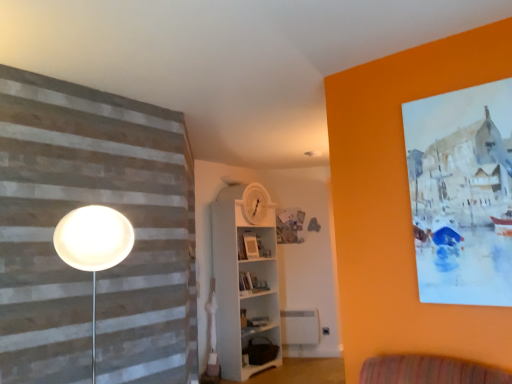
Question: Can you confirm if brown fabric bag at lower center, which appears as the 2th shelf when viewed from the top, is shorter than matte white picture frame at center?

Choices:
 (A) yes
 (B) no

Answer: (A)

Question: From the image's perspective, does brown fabric bag at lower center, marked as the first shelf in a bottom-to-top arrangement, appear lower than matte white picture frame at center?

Choices:
 (A) no
 (B) yes

Answer: (B)

Question: Does brown fabric bag at lower center, which appears as the 2th shelf when viewed from the top, have a lesser width compared to matte white picture frame at center?

Choices:
 (A) yes
 (B) no

Answer: (B)

Question: Is there a large distance between brown fabric bag at lower center, which appears as the 2th shelf when viewed from the top, and matte white picture frame at center?

Choices:
 (A) yes
 (B) no

Answer: (A)

Question: From a real-world perspective, is brown fabric bag at lower center, marked as the first shelf in a bottom-to-top arrangement, positioned over matte white picture frame at center based on gravity?

Choices:
 (A) no
 (B) yes

Answer: (A)

Question: Can we say brown fabric bag at lower center, marked as the first shelf in a bottom-to-top arrangement, lies outside matte white picture frame at center?

Choices:
 (A) no
 (B) yes

Answer: (B)

Question: Could you tell me if matte white picture frame at center is turned towards brown fabric bag at lower center, which appears as the 2th shelf when viewed from the top?

Choices:
 (A) no
 (B) yes

Answer: (A)

Question: Does matte white picture frame at center have a lesser height compared to brown fabric bag at lower center, marked as the first shelf in a bottom-to-top arrangement?

Choices:
 (A) yes
 (B) no

Answer: (B)

Question: Is matte white picture frame at center at the right side of brown fabric bag at lower center, marked as the first shelf in a bottom-to-top arrangement?

Choices:
 (A) yes
 (B) no

Answer: (B)

Question: From a real-world perspective, does matte white picture frame at center stand above brown fabric bag at lower center, which appears as the 2th shelf when viewed from the top?

Choices:
 (A) yes
 (B) no

Answer: (A)

Question: Is matte white picture frame at center further to the viewer compared to brown fabric bag at lower center, marked as the first shelf in a bottom-to-top arrangement?

Choices:
 (A) yes
 (B) no

Answer: (A)

Question: Is matte white picture frame at center at the left side of brown fabric bag at lower center, which appears as the 2th shelf when viewed from the top?

Choices:
 (A) no
 (B) yes

Answer: (B)

Question: Is matte white picture frame at center completely or partially outside of white wooden shelf at center, which is counted as the first shelf, starting from the top?

Choices:
 (A) yes
 (B) no

Answer: (B)